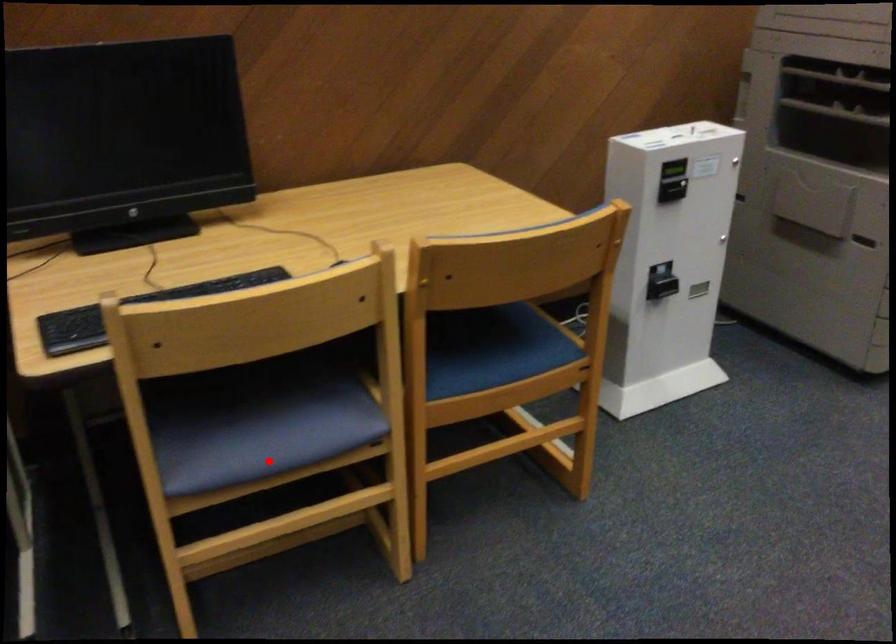
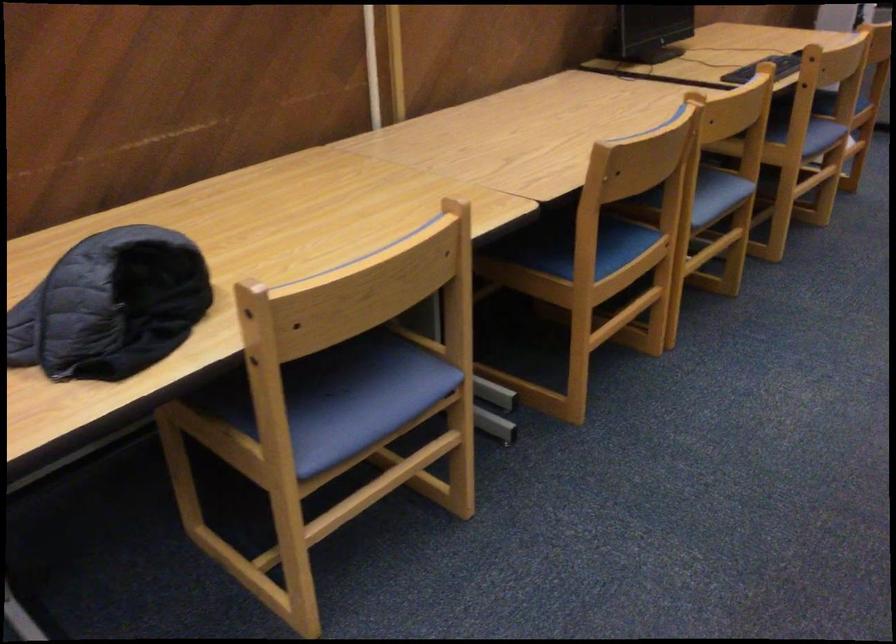
The point at the highlighted location is marked in the first image. Where is the corresponding point in the second image?

(821, 136)